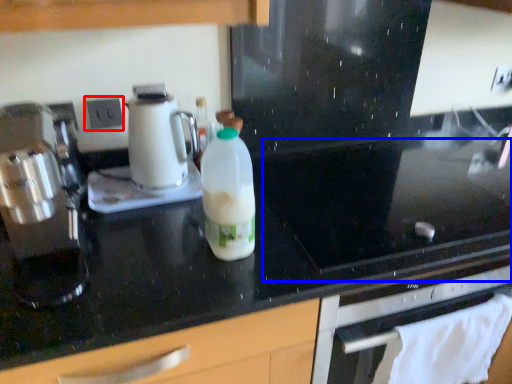
Question: Which object is further to the camera taking this photo, electric outlet (highlighted by a red box) or gas stove (highlighted by a blue box)?

Choices:
 (A) electric outlet
 (B) gas stove

Answer: (A)